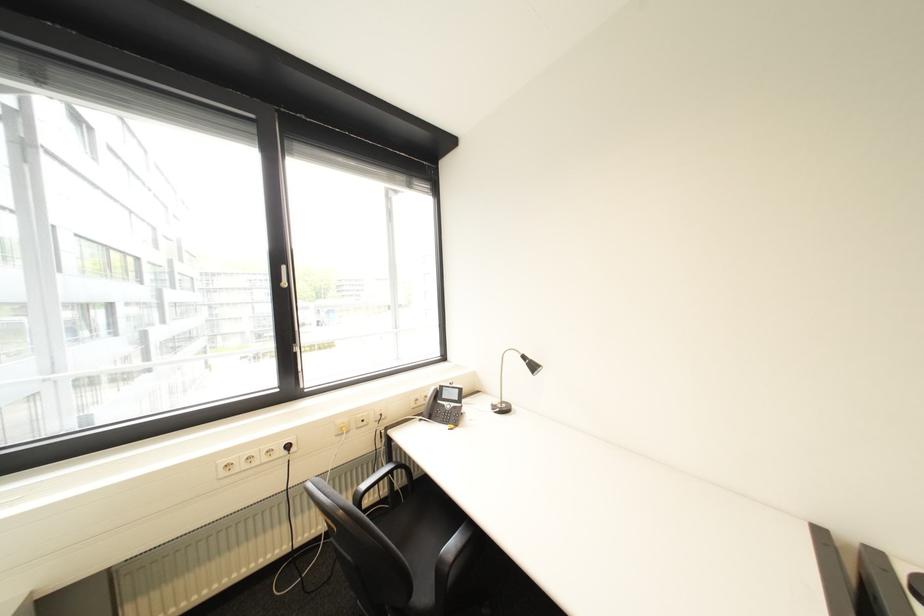
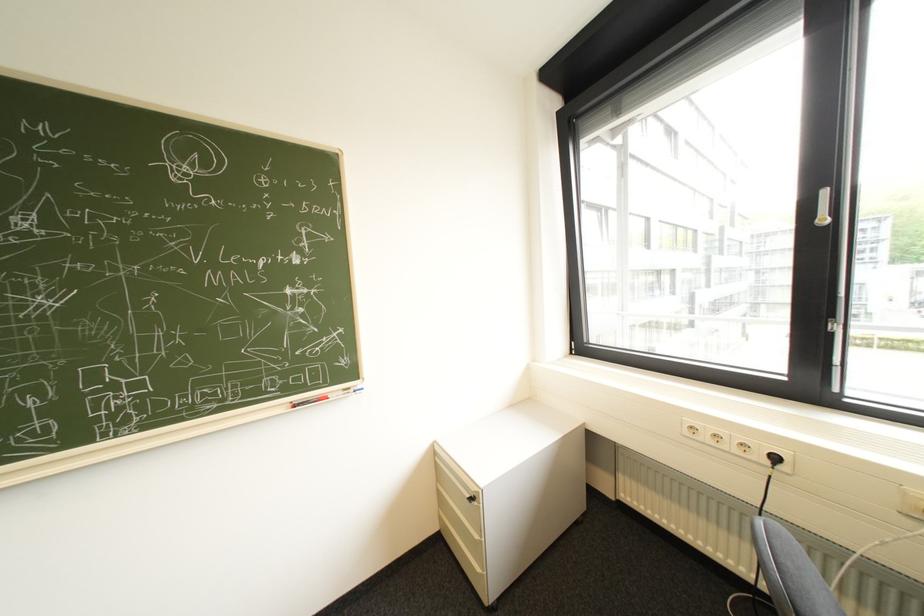
The point at (250, 467) is marked in the first image. Where is the corresponding point in the second image?

(715, 438)